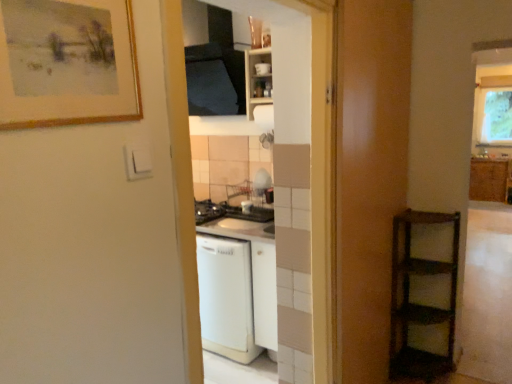
In order to face wooden shelf at right, positioned as the first screen door in right-to-left order, should I rotate leftwards or rightwards?

You should rotate right by 16.420 degrees.

Image resolution: width=512 pixels, height=384 pixels. Describe the element at coordinates (489, 180) in the screenshot. I see `wooden cabinet at right, the second cabinetry viewed from the left` at that location.

The height and width of the screenshot is (384, 512). Describe the element at coordinates (226, 297) in the screenshot. I see `white matte dishwasher at center` at that location.

What are the coordinates of `wooden shelf at right, the 2th screen door positioned from the left` in the screenshot? It's located at (368, 177).

Who is shorter, white matte cabinet at upper center, arranged as the first cabinetry when viewed from the left, or white glossy dishwasher at center, the 2th screen door when ordered from right to left?

white matte cabinet at upper center, arranged as the first cabinetry when viewed from the left, is shorter.

Can you confirm if white matte cabinet at upper center, placed as the 1th cabinetry when sorted from front to back, is thinner than white glossy dishwasher at center, the 2th screen door when ordered from right to left?

In fact, white matte cabinet at upper center, placed as the 1th cabinetry when sorted from front to back, might be wider than white glossy dishwasher at center, the 2th screen door when ordered from right to left.

Considering the points (250, 71) and (314, 114), which point is in front, point (250, 71) or point (314, 114)?

Positioned in front is point (314, 114).

Could you tell me if white matte cabinet at upper center, positioned as the second cabinetry in right-to-left order, is facing white glossy dishwasher at center, the 2th screen door when ordered from right to left?

No, white matte cabinet at upper center, positioned as the second cabinetry in right-to-left order, is not aimed at white glossy dishwasher at center, the 2th screen door when ordered from right to left.

What's the angular difference between white matte cabinet at upper center, marked as the 2th cabinetry in a back-to-front arrangement, and wooden shelf at right, the 2th screen door positioned from the left,'s facing directions?

The angle between the facing direction of white matte cabinet at upper center, marked as the 2th cabinetry in a back-to-front arrangement, and the facing direction of wooden shelf at right, the 2th screen door positioned from the left, is 86.4 degrees.

Is wooden shelf at right, the 2th screen door positioned from the left, completely or partially inside white matte cabinet at upper center, positioned as the second cabinetry in right-to-left order?

No, wooden shelf at right, the 2th screen door positioned from the left, is not surrounded by white matte cabinet at upper center, positioned as the second cabinetry in right-to-left order.

Considering the positions of objects white matte cabinet at upper center, arranged as the first cabinetry when viewed from the left, and wooden shelf at right, positioned as the first screen door in right-to-left order, in the image provided, who is more to the right, white matte cabinet at upper center, arranged as the first cabinetry when viewed from the left, or wooden shelf at right, positioned as the first screen door in right-to-left order,?

wooden shelf at right, positioned as the first screen door in right-to-left order.

Locate an element on the screen. The height and width of the screenshot is (384, 512). picture frame above the clear glass window at upper right (from a real-world perspective) is located at coordinates click(67, 63).

From a real-world perspective, between wooden-framed painting at upper left and clear glass window at upper right, who is vertically lower?

In real-world perspective, clear glass window at upper right is lower.

Is wooden-framed painting at upper left wider than clear glass window at upper right?

No.

Can you see wooden shelf at right, positioned as the first screen door in right-to-left order, touching wooden-framed painting at upper left?

No, wooden shelf at right, positioned as the first screen door in right-to-left order, is not touching wooden-framed painting at upper left.

Is point (338, 199) farther from camera compared to point (25, 42)?

Yes, it is.

Is wooden shelf at right, positioned as the first screen door in right-to-left order, oriented towards wooden-framed painting at upper left?

No.

Does white matte dishwasher at center appear on the right side of clear glass window at upper right?

Incorrect, white matte dishwasher at center is not on the right side of clear glass window at upper right.

Which is behind, point (251, 288) or point (478, 143)?

The point (478, 143) is farther from the camera.

Can you tell me how much white matte dishwasher at center and clear glass window at upper right differ in facing direction?

The facing directions of white matte dishwasher at center and clear glass window at upper right are 1.5 degrees apart.

From the image's perspective, is white matte dishwasher at center on top of clear glass window at upper right?

No, from the image's perspective, white matte dishwasher at center is not on top of clear glass window at upper right.

I want to click on cabinetry above the wooden cabinet at right, which appears as the 1th cabinetry when viewed from the back (from a real-world perspective), so click(258, 79).

Could you measure the distance between wooden cabinet at right, the 1th cabinetry in the right-to-left sequence, and white matte cabinet at upper center, positioned as the second cabinetry in right-to-left order?

wooden cabinet at right, the 1th cabinetry in the right-to-left sequence, and white matte cabinet at upper center, positioned as the second cabinetry in right-to-left order, are 2.71 meters apart from each other.

Is point (500, 181) closer to camera compared to point (259, 57)?

That is False.

Does wooden cabinet at right, the second cabinetry viewed from the left, turn towards white matte cabinet at upper center, positioned as the second cabinetry in right-to-left order?

Yes, wooden cabinet at right, the second cabinetry viewed from the left, is aimed at white matte cabinet at upper center, positioned as the second cabinetry in right-to-left order.

Between clear glass window at upper right and wooden shelf at right, the 2th screen door positioned from the left, which one appears on the left side from the viewer's perspective?

wooden shelf at right, the 2th screen door positioned from the left, is more to the left.

Does clear glass window at upper right have a larger size compared to wooden shelf at right, positioned as the first screen door in right-to-left order?

No, clear glass window at upper right is not bigger than wooden shelf at right, positioned as the first screen door in right-to-left order.

Is wooden shelf at right, positioned as the first screen door in right-to-left order, at the back of clear glass window at upper right?

No, wooden shelf at right, positioned as the first screen door in right-to-left order, is not at the back of clear glass window at upper right.

Would you consider clear glass window at upper right to be distant from wooden shelf at right, positioned as the first screen door in right-to-left order?

Yes, clear glass window at upper right and wooden shelf at right, positioned as the first screen door in right-to-left order, are quite far apart.

The width and height of the screenshot is (512, 384). I want to click on the 2nd screen door below when counting from the white matte cabinet at upper center, positioned as the second cabinetry in right-to-left order (from the image's perspective), so click(x=301, y=165).

This screenshot has height=384, width=512. I want to click on the 1st screen door in front of the white matte cabinet at upper center, marked as the 2th cabinetry in a back-to-front arrangement, counting from the anchor's position, so click(x=368, y=177).

When comparing their distances from white glossy dishwasher at center, marked as the first screen door in a left-to-right arrangement, does wooden shelf at right, the 2th screen door positioned from the left, or white matte dishwasher at center seem further?

white matte dishwasher at center is positioned further to the anchor white glossy dishwasher at center, marked as the first screen door in a left-to-right arrangement.

From the image, which object appears to be nearer to wooden shelf at right, the 2th screen door positioned from the left, clear glass window at upper right or white glossy dishwasher at center, marked as the first screen door in a left-to-right arrangement?

Based on the image, white glossy dishwasher at center, marked as the first screen door in a left-to-right arrangement, appears to be nearer to wooden shelf at right, the 2th screen door positioned from the left.

From the image, which object appears to be farther from wooden shelf at right, the 2th screen door positioned from the left, white matte cabinet at upper center, arranged as the first cabinetry when viewed from the left, or wooden cabinet at right, placed as the second cabinetry when sorted from front to back?

wooden cabinet at right, placed as the second cabinetry when sorted from front to back, is further to wooden shelf at right, the 2th screen door positioned from the left.

Which object lies further to the anchor point white matte dishwasher at center, white matte cabinet at upper center, marked as the 2th cabinetry in a back-to-front arrangement, or clear glass window at upper right?

The object further to white matte dishwasher at center is clear glass window at upper right.

Looking at the image, which one is located closer to wooden-framed painting at upper left, white glossy dishwasher at center, the 2th screen door when ordered from right to left, or wooden cabinet at right, placed as the second cabinetry when sorted from front to back?

Among the two, white glossy dishwasher at center, the 2th screen door when ordered from right to left, is located nearer to wooden-framed painting at upper left.

Looking at the image, which one is located further to white glossy dishwasher at center, marked as the first screen door in a left-to-right arrangement, wooden shelf at right, the 2th screen door positioned from the left, or wooden-framed painting at upper left?

wooden-framed painting at upper left lies further to white glossy dishwasher at center, marked as the first screen door in a left-to-right arrangement, than the other object.

Looking at the image, which one is located closer to white glossy dishwasher at center, marked as the first screen door in a left-to-right arrangement, wooden-framed painting at upper left or white matte cabinet at upper center, placed as the 1th cabinetry when sorted from front to back?

The object closer to white glossy dishwasher at center, marked as the first screen door in a left-to-right arrangement, is white matte cabinet at upper center, placed as the 1th cabinetry when sorted from front to back.

Looking at this image, considering their positions, is wooden shelf at right, positioned as the first screen door in right-to-left order, positioned further to wooden cabinet at right, placed as the second cabinetry when sorted from front to back, than wooden-framed painting at upper left?

wooden-framed painting at upper left lies further to wooden cabinet at right, placed as the second cabinetry when sorted from front to back, than the other object.

At what (x,y) coordinates should I click in order to perform the action: click on cabinetry between white matte dishwasher at center and wooden cabinet at right, the 1th cabinetry in the right-to-left sequence, along the z-axis. Please return your answer as a coordinate pair (x, y). Image resolution: width=512 pixels, height=384 pixels. Looking at the image, I should click on (258, 79).

The height and width of the screenshot is (384, 512). I want to click on dish washer positioned between wooden-framed painting at upper left and wooden cabinet at right, the second cabinetry viewed from the left, from near to far, so click(226, 297).

What are the coordinates of `cabinetry between white matte cabinet at upper center, arranged as the first cabinetry when viewed from the left, and clear glass window at upper right from front to back` in the screenshot? It's located at (489, 180).

Identify the location of dish washer located between white glossy dishwasher at center, the 2th screen door when ordered from right to left, and wooden cabinet at right, the second cabinetry viewed from the left, in the depth direction. The image size is (512, 384). (226, 297).